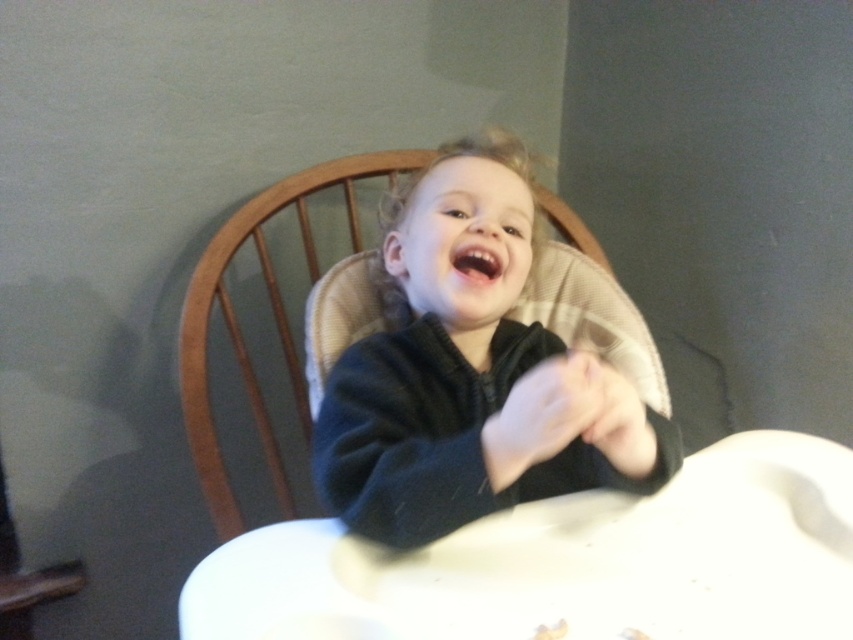
Does white plastic high chair at center come in front of dark blue fleece at center?

That is True.

Can you confirm if white plastic high chair at center is smaller than dark blue fleece at center?

Yes, white plastic high chair at center is smaller than dark blue fleece at center.

Who is more forward, (463, 534) or (514, 260)?

Point (463, 534) is more forward.

Where is `white plastic high chair at center`? The height and width of the screenshot is (640, 853). white plastic high chair at center is located at coordinates (569, 563).

This screenshot has height=640, width=853. What do you see at coordinates (569, 563) in the screenshot? I see `white plastic high chair at center` at bounding box center [569, 563].

Which of these two, white plastic high chair at center or matte black hand at center, stands taller?

Standing taller between the two is matte black hand at center.

Locate an element on the screen. This screenshot has height=640, width=853. white plastic high chair at center is located at coordinates (569, 563).

Is dark blue fleece at center below matte black hand at center?

No.

I want to click on dark blue fleece at center, so click(471, 371).